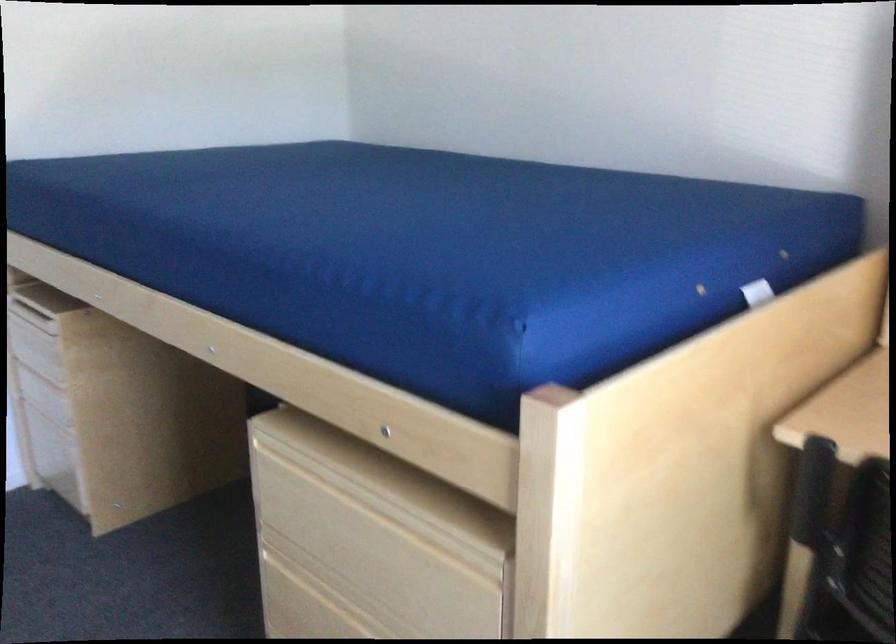
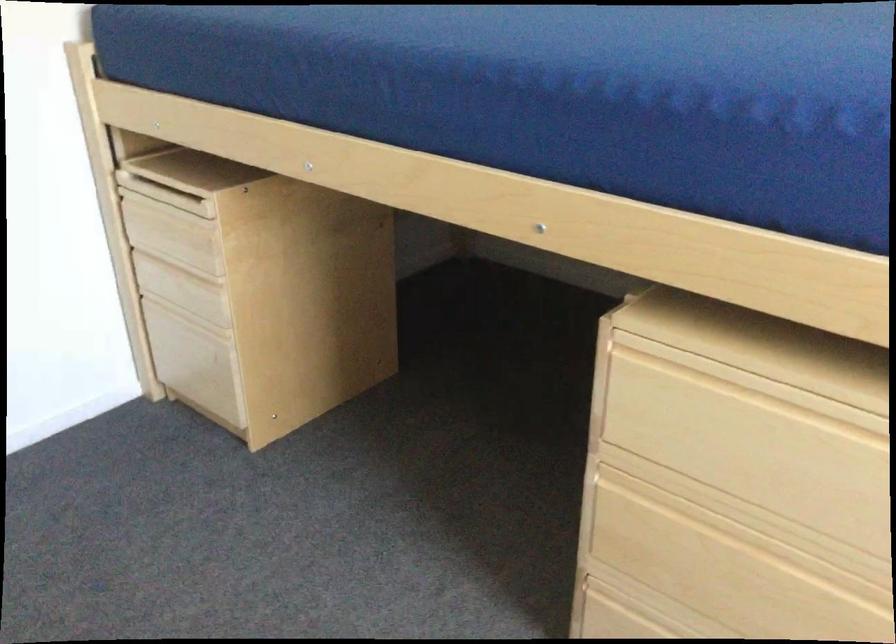
Question: The first image is from the beginning of the video and the second image is from the end. How did the camera likely rotate when shooting the video?

Choices:
 (A) Left
 (B) Right
 (C) Up
 (D) Down

Answer: (D)